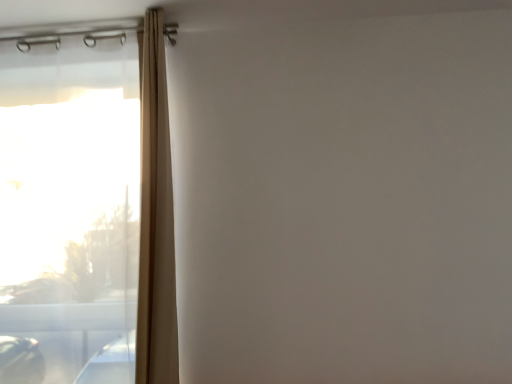
Describe the element at coordinates (86, 207) in the screenshot. I see `transparent plastic window at left` at that location.

What is the approximate height of transparent plastic window at left?

transparent plastic window at left is 5.36 feet tall.

Where is `transparent plastic window at left`? This screenshot has height=384, width=512. transparent plastic window at left is located at coordinates (86, 207).

What do you see at coordinates (155, 216) in the screenshot? The height and width of the screenshot is (384, 512). I see `beige fabric curtain at left` at bounding box center [155, 216].

Identify the location of beige fabric curtain at left. The image size is (512, 384). (155, 216).

This screenshot has width=512, height=384. I want to click on transparent plastic window at left, so click(86, 207).

In the image, is transparent plastic window at left on the left side or the right side of beige fabric curtain at left?

Based on their positions, transparent plastic window at left is located to the left of beige fabric curtain at left.

Which object is more forward, transparent plastic window at left or beige fabric curtain at left?

beige fabric curtain at left.

Does point (144, 164) appear closer or farther from the camera than point (160, 105)?

Point (144, 164) appears to be closer to the viewer than point (160, 105).

From the image's perspective, which one is positioned higher, transparent plastic window at left or beige fabric curtain at left?

From the image's view, beige fabric curtain at left is above.

From a real-world perspective, is transparent plastic window at left on beige fabric curtain at left?

Actually, transparent plastic window at left is physically below beige fabric curtain at left in the real world.

Considering the sizes of objects transparent plastic window at left and beige fabric curtain at left in the image provided, who is thinner, transparent plastic window at left or beige fabric curtain at left?

With smaller width is transparent plastic window at left.

Does transparent plastic window at left have a greater height compared to beige fabric curtain at left?

Yes, transparent plastic window at left is taller than beige fabric curtain at left.

In terms of size, does transparent plastic window at left appear bigger or smaller than beige fabric curtain at left?

Clearly, transparent plastic window at left is larger in size than beige fabric curtain at left.

Is transparent plastic window at left completely or partially outside of beige fabric curtain at left?

Yes, transparent plastic window at left is outside of beige fabric curtain at left.

Does transparent plastic window at left touch beige fabric curtain at left?

No, transparent plastic window at left is not touching beige fabric curtain at left.

Could you tell me if transparent plastic window at left is turned towards beige fabric curtain at left?

No, transparent plastic window at left is not turned towards beige fabric curtain at left.

How distant is transparent plastic window at left from beige fabric curtain at left?

transparent plastic window at left and beige fabric curtain at left are 24.99 centimeters apart from each other.

The image size is (512, 384). Find the location of `shower curtain above the transparent plastic window at left (from a real-world perspective)`. shower curtain above the transparent plastic window at left (from a real-world perspective) is located at coordinates (155, 216).

Considering the relative positions of beige fabric curtain at left and transparent plastic window at left in the image provided, is beige fabric curtain at left to the left or to the right of transparent plastic window at left?

beige fabric curtain at left is positioned on transparent plastic window at left's right side.

Is beige fabric curtain at left in front of transparent plastic window at left?

Yes.

Between point (146, 349) and point (36, 192), which one is positioned behind?

The point (36, 192) is more distant.

From the image's perspective, is beige fabric curtain at left located above or below transparent plastic window at left?

beige fabric curtain at left is above transparent plastic window at left.

From a real-world perspective, relative to transparent plastic window at left, is beige fabric curtain at left vertically above or below?

beige fabric curtain at left is situated higher than transparent plastic window at left in the real world.

Looking at their sizes, would you say beige fabric curtain at left is wider or thinner than transparent plastic window at left?

Considering their sizes, beige fabric curtain at left looks broader than transparent plastic window at left.

Considering the sizes of objects beige fabric curtain at left and transparent plastic window at left in the image provided, who is taller, beige fabric curtain at left or transparent plastic window at left?

transparent plastic window at left.

Which of these two, beige fabric curtain at left or transparent plastic window at left, is smaller?

beige fabric curtain at left.

Does beige fabric curtain at left contain transparent plastic window at left?

No, transparent plastic window at left is not surrounded by beige fabric curtain at left.

Are beige fabric curtain at left and transparent plastic window at left beside each other?

No, beige fabric curtain at left is not with transparent plastic window at left.

Is beige fabric curtain at left oriented away from transparent plastic window at left?

No, beige fabric curtain at left's orientation is not away from transparent plastic window at left.

The image size is (512, 384). I want to click on window lying behind the beige fabric curtain at left, so click(86, 207).

Image resolution: width=512 pixels, height=384 pixels. Identify the location of shower curtain in front of the transparent plastic window at left. (155, 216).

The height and width of the screenshot is (384, 512). I want to click on window lying on the left of beige fabric curtain at left, so click(86, 207).